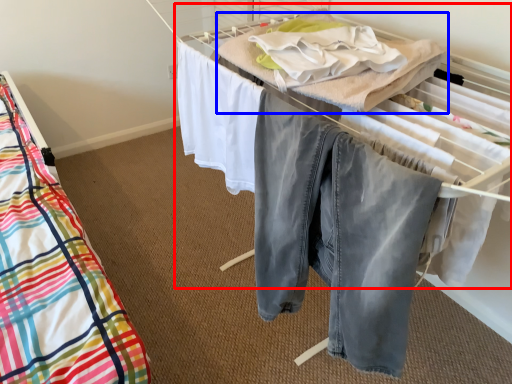
Question: Which of the following is the farthest to the observer, bed (highlighted by a red box) or blanket (highlighted by a blue box)?

Choices:
 (A) bed
 (B) blanket

Answer: (A)